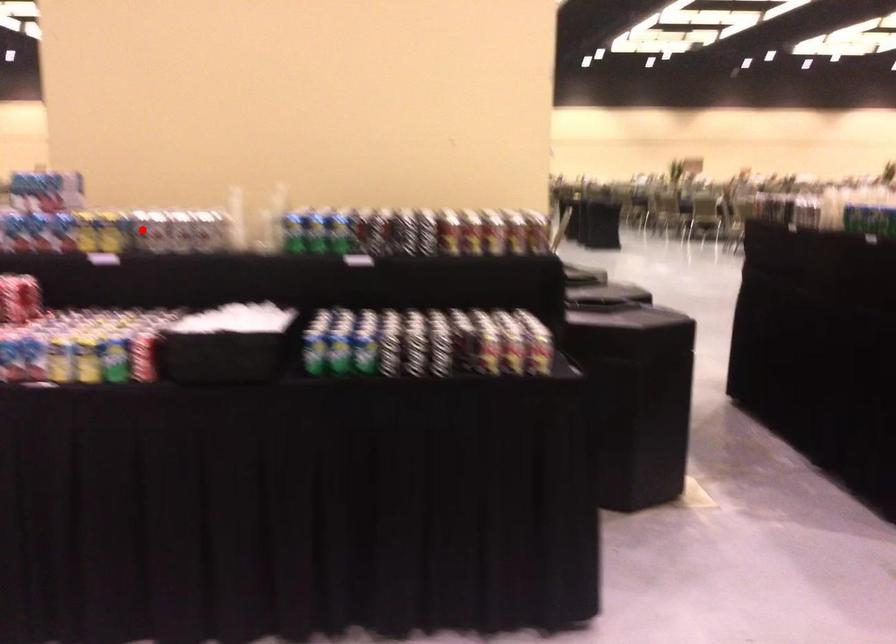
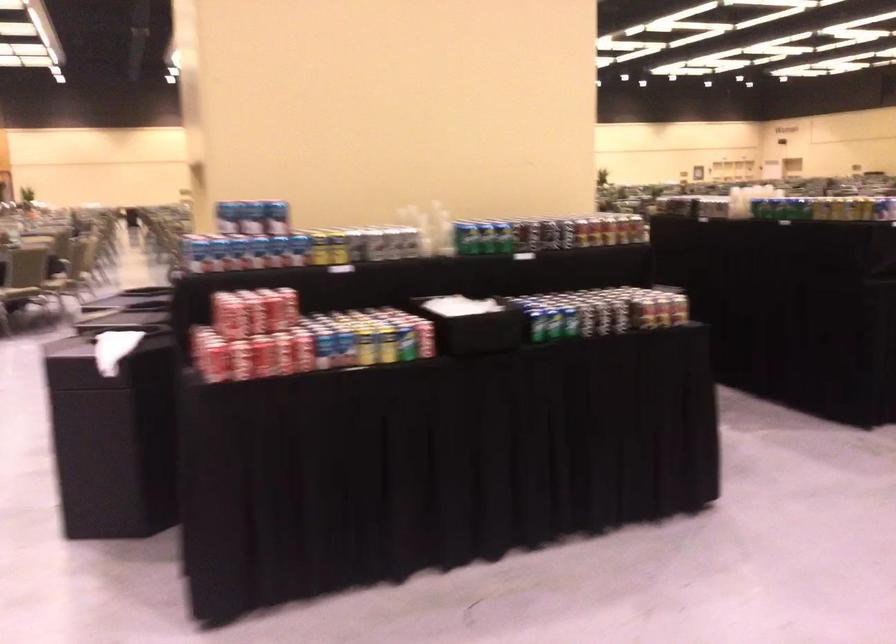
Question: I am providing you with two images of the same scene from different viewpoints. Image1 has a red point marked. In image2, the corresponding 3D location appears at what relative position? Reply with the corresponding letter.

Choices:
 (A) Closer
 (B) Farther

Answer: (B)